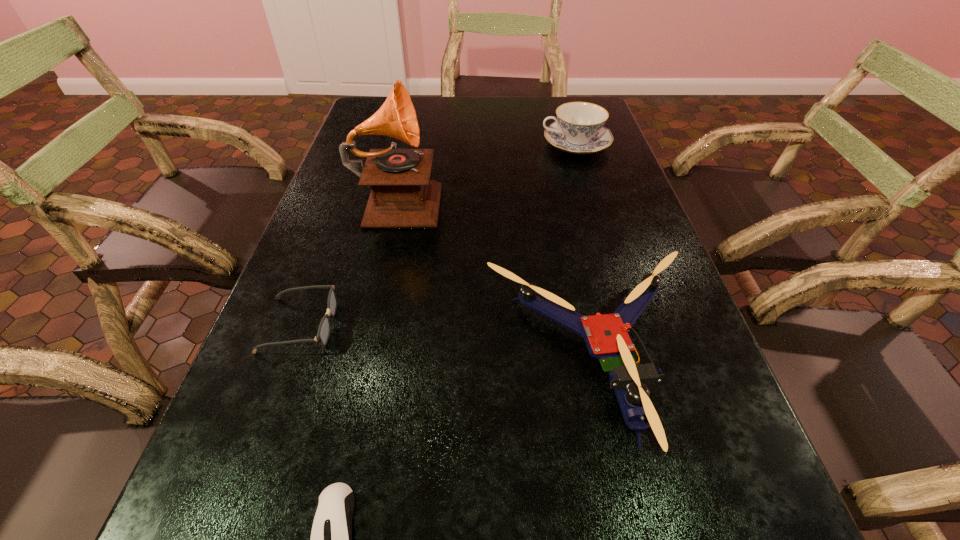
Locate an element on the screen. free spot located on the face of the second shortest object is located at coordinates (457, 325).

The width and height of the screenshot is (960, 540). Find the location of `object that is at the far edge`. object that is at the far edge is located at coordinates pos(578,129).

Locate an element on the screen. phonograph record present at the left edge is located at coordinates (402, 196).

The height and width of the screenshot is (540, 960). In order to click on spectacles situated at the left edge in this screenshot , I will do `click(323, 333)`.

Locate an element on the screen. chinaware located in the right edge section of the desktop is located at coordinates (578, 129).

Locate an element on the screen. This screenshot has width=960, height=540. drone situated at the right edge is located at coordinates (606, 336).

The width and height of the screenshot is (960, 540). Identify the location of object that is at the far right corner. (578, 129).

Identify the location of vacant area at the far edge. (541, 127).

Find the location of a particular element. free space at the left edge of the desktop is located at coordinates (229, 522).

In the image, there is a desktop. At what (x,y) coordinates should I click in order to perform the action: click on vacant space at the right edge. Please return your answer as a coordinate pair (x, y). The width and height of the screenshot is (960, 540). Looking at the image, I should click on (688, 459).